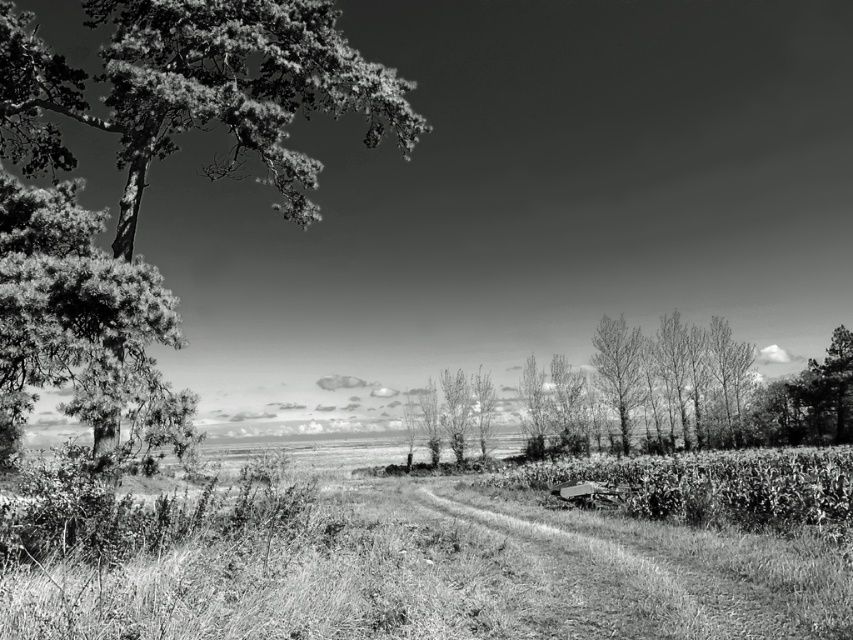
Question: Among these points, which one is nearest to the camera?

Choices:
 (A) (161, 337)
 (B) (778, 541)

Answer: (A)

Question: Does grassy field at center lie in front of thick textured pine tree at left?

Choices:
 (A) yes
 (B) no

Answer: (A)

Question: Does dark green textured tree at left come in front of dirt/grass at lower center?

Choices:
 (A) no
 (B) yes

Answer: (A)

Question: Among these points, which one is farthest from the camera?

Choices:
 (A) (688, 616)
 (B) (51, 58)
 (C) (119, 616)

Answer: (B)

Question: Which object appears farthest from the camera in this image?

Choices:
 (A) dark green textured tree at left
 (B) dirt/grass at lower center
 (C) smooth bark trees at center

Answer: (C)

Question: Is grassy field at center to the left of smooth bark trees at center from the viewer's perspective?

Choices:
 (A) no
 (B) yes

Answer: (B)